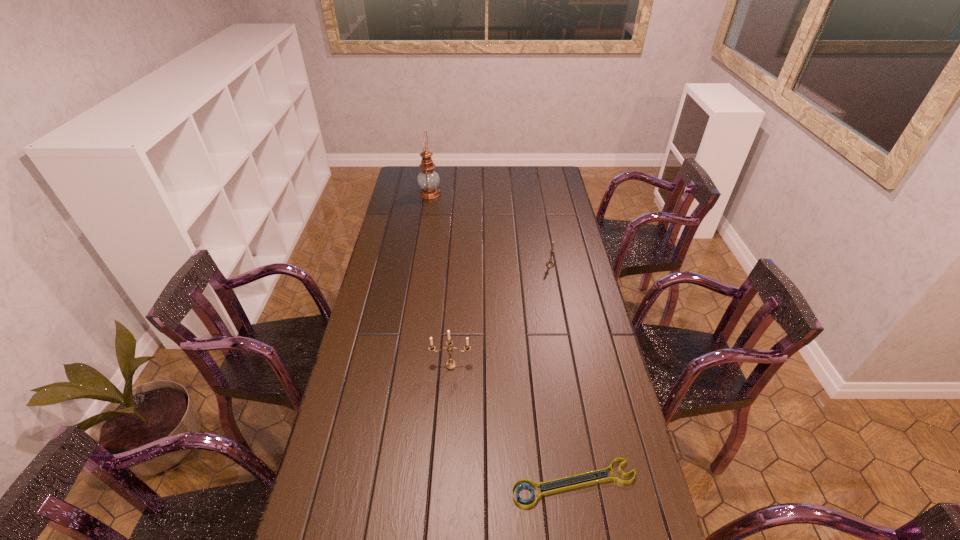
I want to click on free space located 0.260m on the back of the third tallest object, so click(x=543, y=226).

This screenshot has height=540, width=960. Find the location of `free space located on the back of the wrench`. free space located on the back of the wrench is located at coordinates (564, 423).

Where is `object that is at the far edge`? This screenshot has width=960, height=540. object that is at the far edge is located at coordinates (428, 180).

The height and width of the screenshot is (540, 960). I want to click on object present at the left edge, so (x=428, y=180).

Find the location of a particular element. candle that is at the right edge is located at coordinates (550, 264).

I want to click on wrench situated at the right edge, so click(547, 491).

In order to click on object present at the far left corner in this screenshot , I will do tap(428, 180).

You are a GUI agent. You are given a task and a screenshot of the screen. Output one action in this format:
    pyautogui.click(x=<x>, y=<y>)
    Task: Click on the blank space at the far edge of the desktop
    The image size is (960, 540).
    Given the screenshot: What is the action you would take?
    pyautogui.click(x=464, y=186)

The height and width of the screenshot is (540, 960). Find the location of `vacant space at the left edge of the desktop`. vacant space at the left edge of the desktop is located at coordinates (396, 282).

In the image, there is a desktop. Identify the location of vacant space at the right edge. (578, 350).